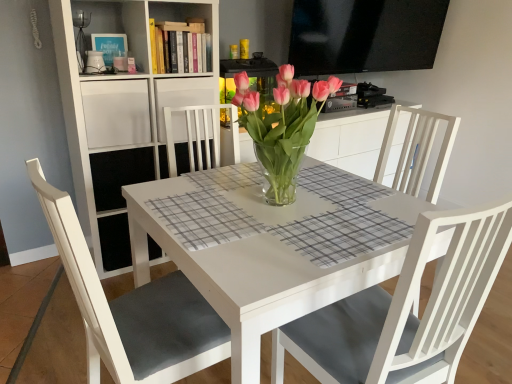
Find the location of a particular element. This screenshot has height=384, width=512. empty space that is ontop of white glossy table at center is located at coordinates (271, 203).